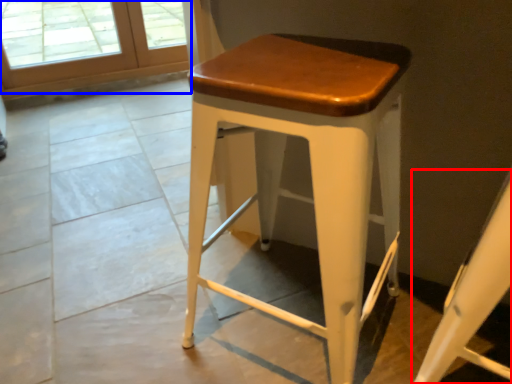
Question: Which object appears farthest to the camera in this image, swivel chair (highlighted by a red box) or screen door (highlighted by a blue box)?

Choices:
 (A) swivel chair
 (B) screen door

Answer: (B)